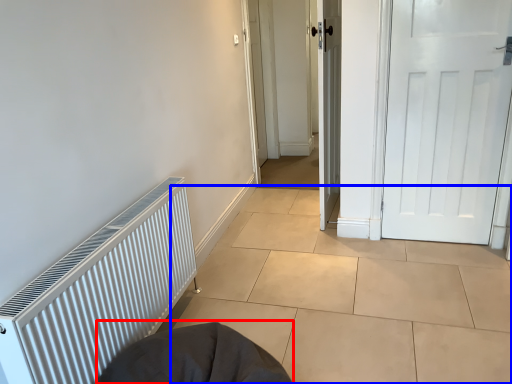
Question: Which object appears farthest to the camera in this image, sleeping bag (highlighted by a red box) or tile (highlighted by a blue box)?

Choices:
 (A) sleeping bag
 (B) tile

Answer: (B)